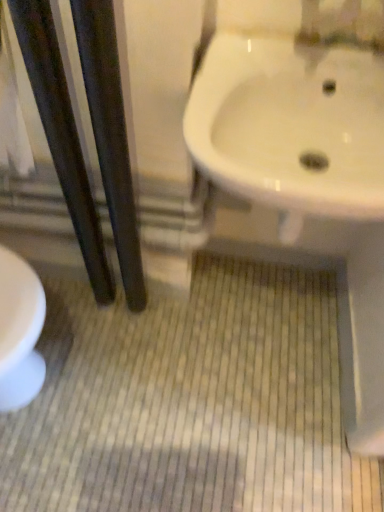
Where is `vacant area to the left of black glossy poles at left, the 1th pole viewed from the right`? vacant area to the left of black glossy poles at left, the 1th pole viewed from the right is located at coordinates 78,323.